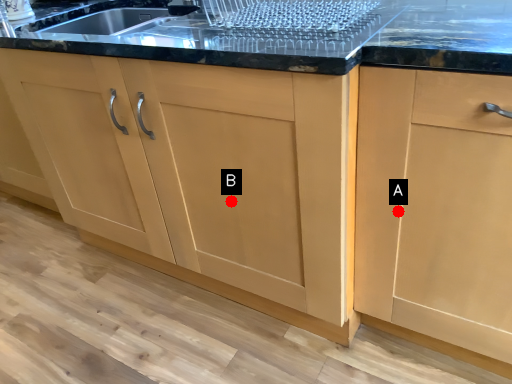
Question: Two points are circled on the image, labeled by A and B beside each circle. Which point is closer to the camera taking this photo?

Choices:
 (A) A is closer
 (B) B is closer

Answer: (A)